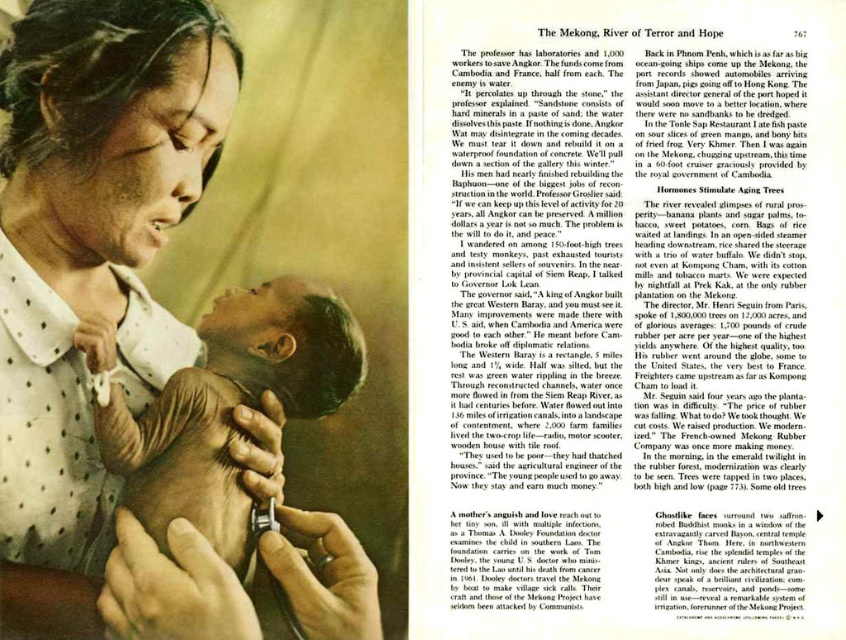
Question: Which of the following is the farthest from the observer?

Choices:
 (A) (202, 516)
 (B) (92, 81)

Answer: (A)

Question: Observing the image, what is the correct spatial positioning of matte white blouse at center in reference to light brown skin baby at center?

Choices:
 (A) left
 (B) right

Answer: (A)

Question: Does matte white blouse at center appear over light brown skin baby at center?

Choices:
 (A) no
 (B) yes

Answer: (B)

Question: Can you confirm if matte white blouse at center is positioned above light brown skin baby at center?

Choices:
 (A) no
 (B) yes

Answer: (B)